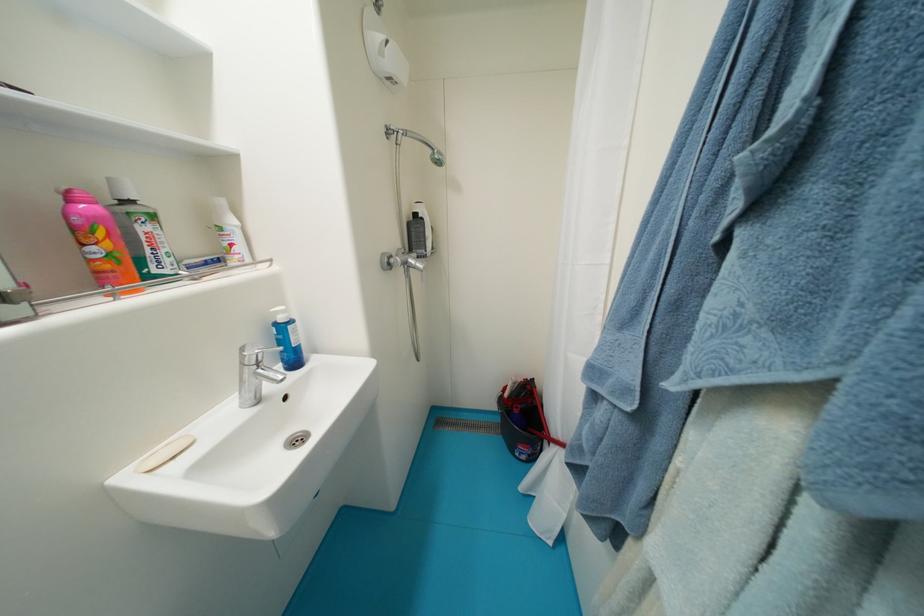
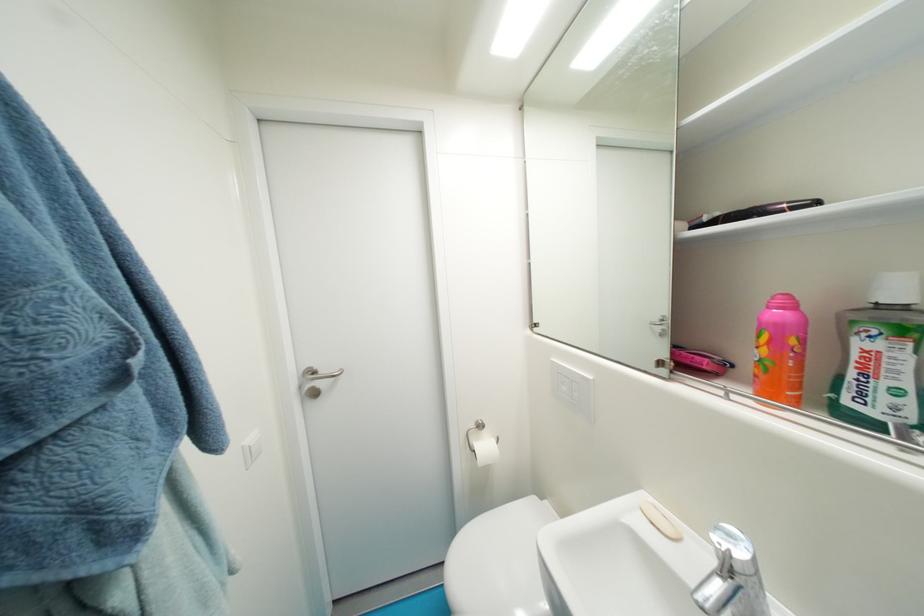
The point at (124, 256) is marked in the first image. Where is the corresponding point in the second image?

(774, 363)